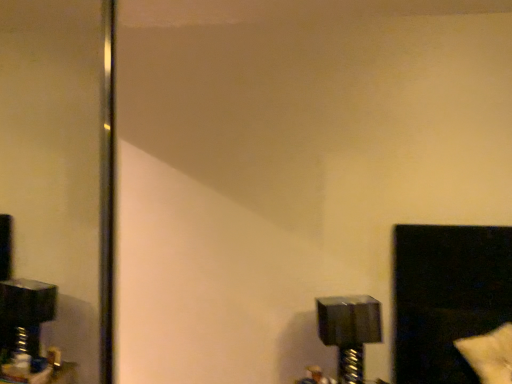
Question: Looking at the image, does black glossy window at lower right seem bigger or smaller compared to metallic silver bolt at lower right?

Choices:
 (A) small
 (B) big

Answer: (B)

Question: From a real-world perspective, is black glossy window at lower right above or below metallic silver bolt at lower right?

Choices:
 (A) above
 (B) below

Answer: (A)

Question: Estimate the real-world distances between objects in this image. Which object is closer to the black plastic mirror at left?

Choices:
 (A) black glossy window at lower right
 (B) white fluffy pillow at lower right
 (C) metallic silver bolt at lower right

Answer: (C)

Question: Estimate the real-world distances between objects in this image. Which object is farther from the white fluffy pillow at lower right?

Choices:
 (A) black plastic mirror at left
 (B) black glossy window at lower right
 (C) metallic silver bolt at lower right

Answer: (A)